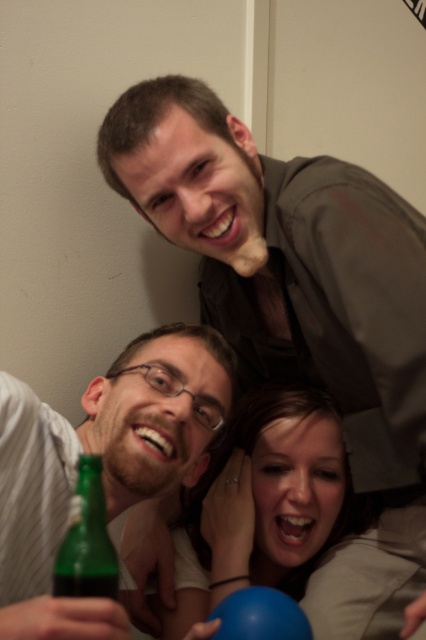
You are a photographer trying to capture a candid shot of the matte brown shirt at upper center and the green glass bottle at lower left. Which object should you focus on first if you want to ensure both are in the frame without moving the camera?

The matte brown shirt at upper center is positioned on the right side of the green glass bottle at lower left. Since the shirt is on the right, you should focus on the green glass bottle at lower left first to ensure both are within the camera frame without moving the camera.

You are taking a photo of the two points in the image. Which point, point (72, 458) or point (285, 634), will appear larger in your photo?

Point (72, 458) will appear larger in the photo because it is closer to the camera than point (285, 634).